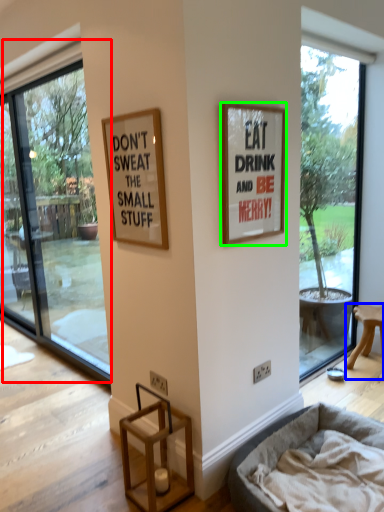
Question: Estimate the real-world distances between objects in this image. Which object is farther from window (highlighted by a red box), furniture (highlighted by a blue box) or picture frame (highlighted by a green box)?

Choices:
 (A) furniture
 (B) picture frame

Answer: (A)